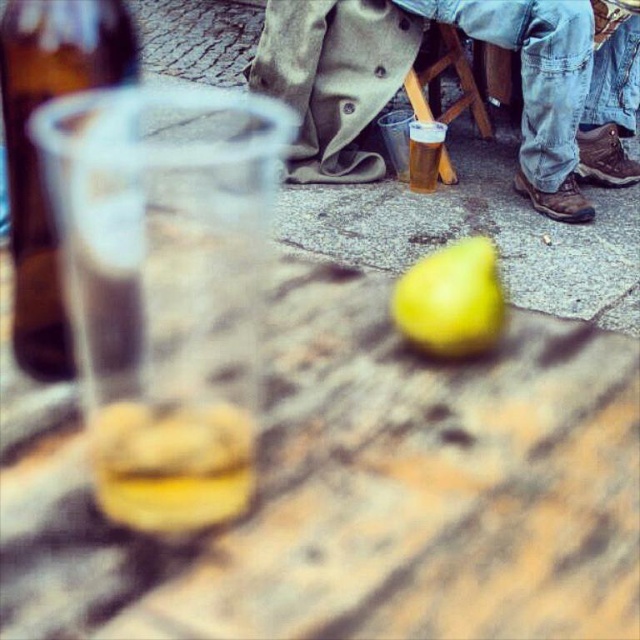
Is point (548, 125) more distant than point (449, 296)?

Yes, it is.

Between point (332, 148) and point (452, 320), which one is positioned in front?

Point (452, 320) is in front.

This screenshot has width=640, height=640. I want to click on denim pants at lower right, so [333, 74].

Measure the distance between point (x=524, y=355) and camera.

15.60 inches

Consider the image. Which is above, wooden table at center or brown glass bottle at left?

Positioned higher is brown glass bottle at left.

Between point (317, 522) and point (40, 84), which one is positioned behind?

The point (40, 84) is behind.

The image size is (640, 640). In order to click on wooden table at center in this screenshot , I will do `click(355, 490)`.

Who is more forward, (454, 289) or (426, 150)?

Positioned in front is point (454, 289).

Does yellow matte pear at center appear under translucent plastic cup at center?

Indeed, yellow matte pear at center is positioned under translucent plastic cup at center.

Is point (436, 252) positioned behind point (426, 150)?

That is False.

The height and width of the screenshot is (640, 640). I want to click on yellow matte pear at center, so click(x=451, y=298).